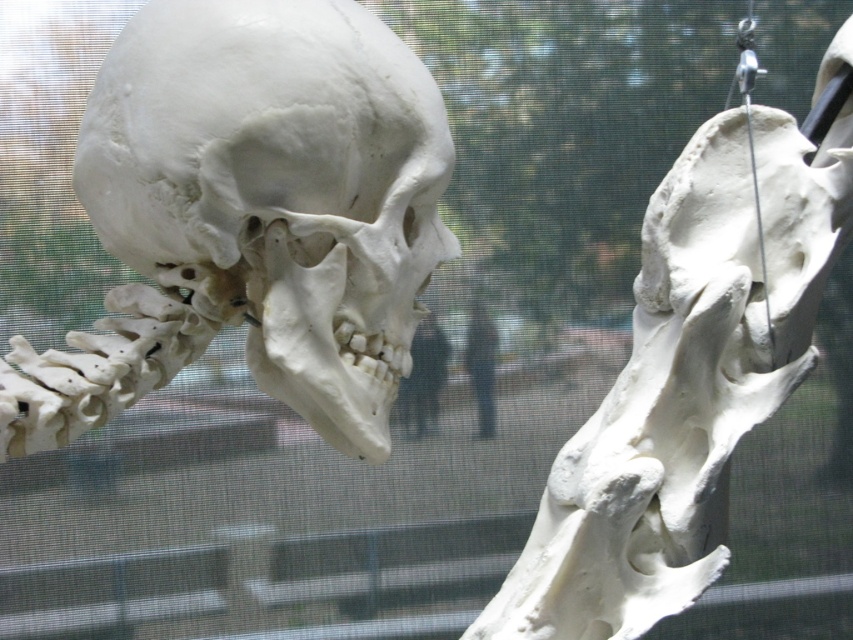
Question: Does black matte person at center have a larger size compared to dark blue jeans at center?

Choices:
 (A) no
 (B) yes

Answer: (B)

Question: Among these points, which one is nearest to the camera?

Choices:
 (A) (473, 385)
 (B) (321, 83)
 (C) (746, 118)

Answer: (B)

Question: Estimate the real-world distances between objects in this image. Which object is closer to the black matte person at center?

Choices:
 (A) white matte skull at upper left
 (B) dark blue jeans at center
 (C) white bone at right

Answer: (B)

Question: From the image, what is the correct spatial relationship of white matte skull at upper left in relation to dark blue jeans at center?

Choices:
 (A) below
 (B) above

Answer: (B)

Question: Is the position of white matte skull at upper left less distant than that of dark blue jeans at center?

Choices:
 (A) no
 (B) yes

Answer: (B)

Question: Which point is farther to the camera?

Choices:
 (A) black matte person at center
 (B) white bone at right
 (C) dark blue jeans at center
 (D) white matte skull at upper left

Answer: (C)